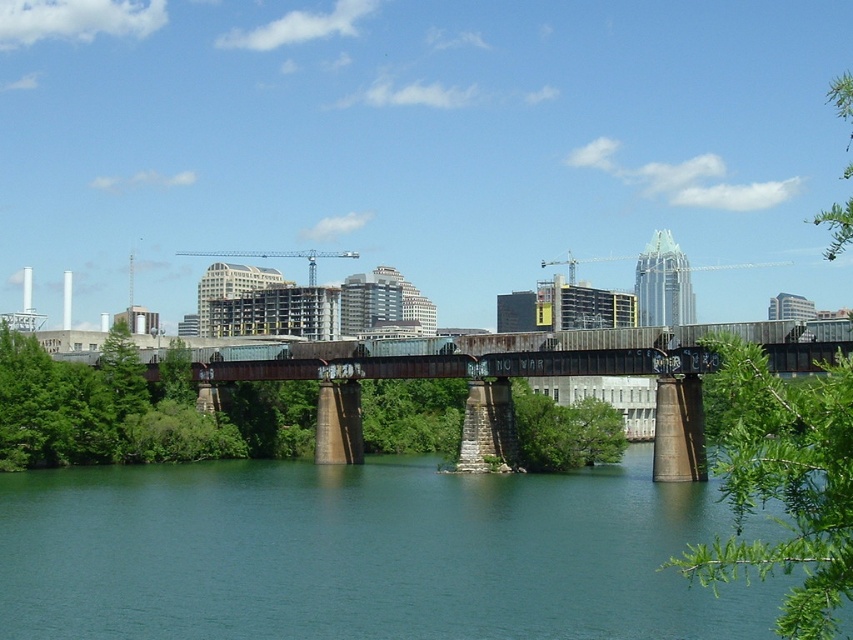
Question: Does green smooth water at center have a greater width compared to green leafy tree at upper right?

Choices:
 (A) yes
 (B) no

Answer: (B)

Question: Can you confirm if green smooth water at center is thinner than green leafy tree at upper right?

Choices:
 (A) yes
 (B) no

Answer: (A)

Question: Which point is closer to the camera?

Choices:
 (A) green leafy tree at upper right
 (B) green smooth water at center

Answer: (A)

Question: Which point is closer to the camera?

Choices:
 (A) (21, 584)
 (B) (740, 538)

Answer: (A)

Question: Is green smooth water at center to the left of green leafy tree at upper right from the viewer's perspective?

Choices:
 (A) no
 (B) yes

Answer: (B)